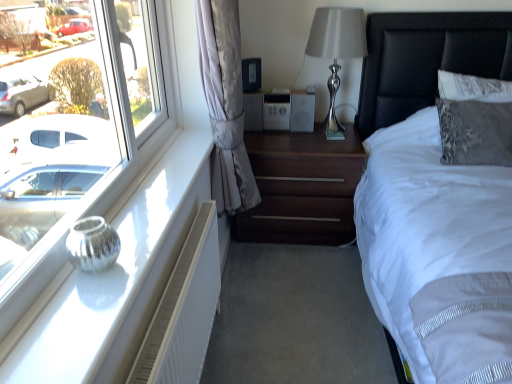
Where is `satin silver lamp at upper right`? satin silver lamp at upper right is located at coordinates (336, 50).

Locate an element on the screen. satin fabric curtain at lower left is located at coordinates (225, 104).

Image resolution: width=512 pixels, height=384 pixels. What do you see at coordinates (426, 59) in the screenshot? I see `black leather headboard at upper right` at bounding box center [426, 59].

Identify the location of white fabric bed at right. (426, 59).

Image resolution: width=512 pixels, height=384 pixels. I want to click on air conditioner lying below the satin fabric curtain at lower left (from the image's perspective), so click(184, 310).

Considering the sizes of satin fabric curtain at lower left and white textured radiator at lower left in the image, is satin fabric curtain at lower left bigger or smaller than white textured radiator at lower left?

Clearly, satin fabric curtain at lower left is larger in size than white textured radiator at lower left.

Does satin fabric curtain at lower left have a greater height compared to white textured radiator at lower left?

Yes, satin fabric curtain at lower left is taller than white textured radiator at lower left.

Is satin fabric curtain at lower left facing away from white textured radiator at lower left?

No.

From the picture: Which of these two, white textured radiator at lower left or silver metallic vase at left, stands shorter?

Standing shorter between the two is silver metallic vase at left.

Is white textured radiator at lower left not close to silver metallic vase at left?

No, white textured radiator at lower left is not far away from silver metallic vase at left.

Can you confirm if white textured radiator at lower left is wider than silver metallic vase at left?

No, white textured radiator at lower left is not wider than silver metallic vase at left.

Is the surface of dark wood nightstand at center in direct contact with white fabric bed at right?

dark wood nightstand at center and white fabric bed at right are clearly separated.

From the image's perspective, is dark wood nightstand at center positioned above or below white fabric bed at right?

dark wood nightstand at center is situated higher than white fabric bed at right in the image.

Looking at their sizes, would you say dark wood nightstand at center is wider or thinner than white fabric bed at right?

Clearly, dark wood nightstand at center has less width compared to white fabric bed at right.

Is satin silver lamp at upper right situated inside white textured radiator at lower left or outside?

satin silver lamp at upper right exists outside the volume of white textured radiator at lower left.

Is satin silver lamp at upper right not close to white textured radiator at lower left?

Absolutely, satin silver lamp at upper right is distant from white textured radiator at lower left.

Is point (311, 37) closer or farther from the camera than point (443, 34)?

Point (311, 37) appears to be closer to the viewer than point (443, 34).

From the image's perspective, is satin silver lamp at upper right below white fabric bed at right?

No, from the image's perspective, satin silver lamp at upper right is not beneath white fabric bed at right.

Based on the photo, who is taller, satin silver lamp at upper right or white fabric bed at right?

Standing taller between the two is white fabric bed at right.

From a real-world perspective, is satin silver lamp at upper right positioned under white fabric bed at right based on gravity?

No, from a real-world perspective, satin silver lamp at upper right is not under white fabric bed at right.

Is point (209, 85) more distant than point (353, 41)?

No, it is in front of (353, 41).

Are satin fabric curtain at lower left and satin silver lamp at upper right beside each other?

No, satin fabric curtain at lower left is not making contact with satin silver lamp at upper right.

From the image's perspective, is satin fabric curtain at lower left over satin silver lamp at upper right?

No.

Is white textured radiator at lower left aimed at dark wood nightstand at center?

No, white textured radiator at lower left is not turned towards dark wood nightstand at center.

Considering the relative positions of white textured radiator at lower left and dark wood nightstand at center in the image provided, is white textured radiator at lower left behind dark wood nightstand at center?

No, white textured radiator at lower left is closer to the camera.

Between white textured radiator at lower left and dark wood nightstand at center, which one appears on the left side from the viewer's perspective?

Positioned to the left is white textured radiator at lower left.

Is white textured radiator at lower left thinner than dark wood nightstand at center?

Yes.

Where is `air conditioner that appears below the satin fabric curtain at lower left (from the image's perspective)`? The image size is (512, 384). air conditioner that appears below the satin fabric curtain at lower left (from the image's perspective) is located at coordinates (184, 310).

The image size is (512, 384). Identify the location of air conditioner on the right of silver metallic vase at left. (184, 310).

Estimate the real-world distances between objects in this image. Which object is closer to white fabric bed at right, satin fabric curtain at lower left or satin silver lamp at upper right?

satin silver lamp at upper right.

When comparing their distances from satin silver lamp at upper right, does silver metallic vase at left or white textured radiator at lower left seem further?

white textured radiator at lower left lies further to satin silver lamp at upper right than the other object.

Considering their positions, is silver metallic vase at left positioned further to black leather headboard at upper right than satin silver lamp at upper right?

Among the two, silver metallic vase at left is located further to black leather headboard at upper right.

Based on the photo, when comparing their distances from silver metallic vase at left, does white fabric bed at right or dark wood nightstand at center seem closer?

dark wood nightstand at center.

Based on their spatial positions, is silver metallic vase at left or black leather headboard at upper right further from satin fabric curtain at lower left?

Among the two, black leather headboard at upper right is located further to satin fabric curtain at lower left.

Considering their positions, is satin fabric curtain at lower left positioned closer to white fabric bed at right than dark wood nightstand at center?

dark wood nightstand at center is closer to white fabric bed at right.

Considering their positions, is white textured radiator at lower left positioned closer to silver metallic vase at left than satin silver lamp at upper right?

white textured radiator at lower left lies closer to silver metallic vase at left than the other object.

Estimate the real-world distances between objects in this image. Which object is closer to satin silver lamp at upper right, dark wood nightstand at center or black leather headboard at upper right?

The object closer to satin silver lamp at upper right is black leather headboard at upper right.

You are a GUI agent. You are given a task and a screenshot of the screen. Output one action in this format:
    pyautogui.click(x=<x>, y=<y>)
    Task: Click on the window sill between satin fabric curtain at lower left and white textured radiator at lower left from top to bottom
    The width and height of the screenshot is (512, 384).
    Given the screenshot: What is the action you would take?
    pyautogui.click(x=118, y=280)

At what (x,y) coordinates should I click in order to perform the action: click on air conditioner between silver metallic vase at left and black leather headboard at upper right in the horizontal direction. Please return your answer as a coordinate pair (x, y). Looking at the image, I should click on (184, 310).

At what (x,y) coordinates should I click in order to perform the action: click on air conditioner positioned between white fabric bed at right and black leather headboard at upper right from near to far. Please return your answer as a coordinate pair (x, y). Image resolution: width=512 pixels, height=384 pixels. Looking at the image, I should click on (184, 310).

This screenshot has width=512, height=384. Identify the location of curtain between silver metallic vase at left and dark wood nightstand at center along the z-axis. (225, 104).